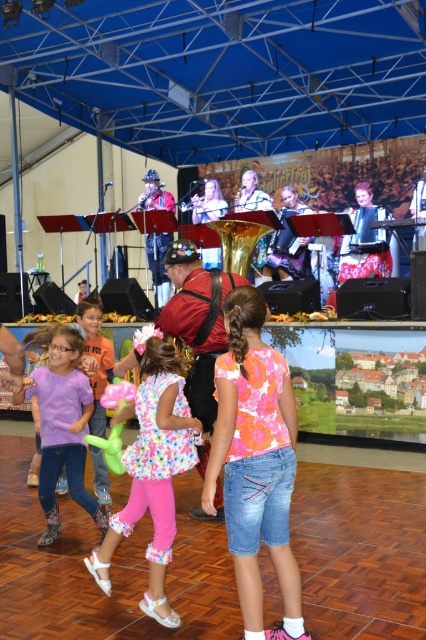
Is point (71, 451) less distant than point (262, 234)?

Yes, point (71, 451) is in front of point (262, 234).

Is purple cotton shirt at lower left below gold brass instrument at center?

Yes, purple cotton shirt at lower left is below gold brass instrument at center.

Does point (92, 508) come in front of point (247, 257)?

Yes, it is.

What are the coordinates of `purple cotton shirt at lower left` in the screenshot? It's located at (62, 422).

In the scene shown: Who is higher up, floral fabric dress at center or purple cotton shirt at lower left?

purple cotton shirt at lower left is higher up.

Is floral fabric dress at center positioned in front of purple cotton shirt at lower left?

Yes.

Is point (166, 612) more distant than point (66, 324)?

That is False.

Find the location of a particular element. The height and width of the screenshot is (640, 426). floral fabric dress at center is located at coordinates (152, 467).

Which is in front, point (259, 332) or point (78, 381)?

Point (259, 332) is in front.

Find the location of a particular element. The height and width of the screenshot is (640, 426). floral cotton shirt at center is located at coordinates click(255, 461).

This screenshot has height=640, width=426. In order to click on floral cotton shirt at center in this screenshot , I will do `click(255, 461)`.